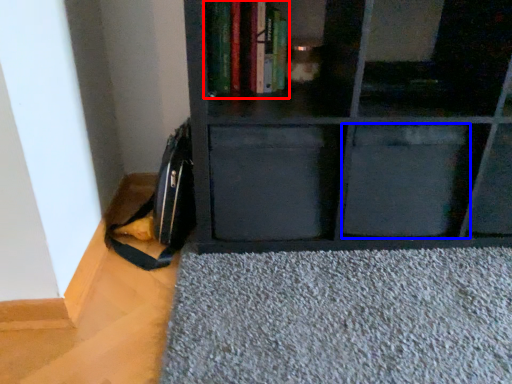
Question: Which object appears closest to the camera in this image, book (highlighted by a red box) or drawer (highlighted by a blue box)?

Choices:
 (A) book
 (B) drawer

Answer: (A)